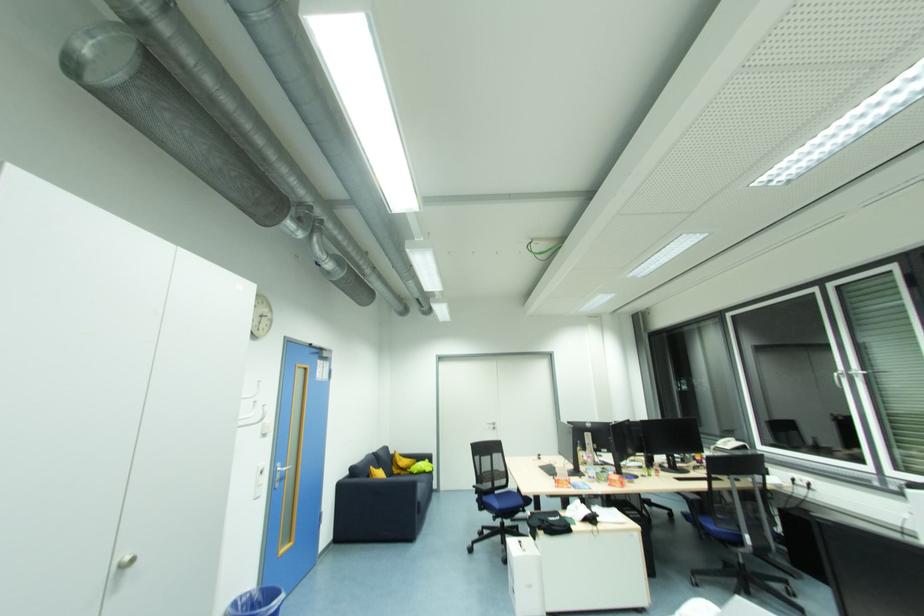
The width and height of the screenshot is (924, 616). What do you see at coordinates (407, 469) in the screenshot?
I see `a blue sofa seat` at bounding box center [407, 469].